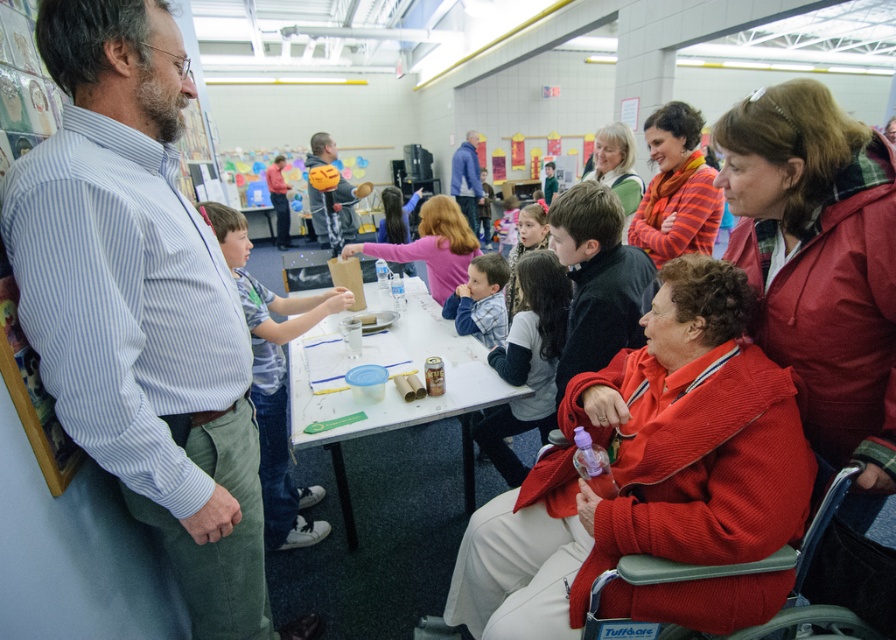
You are a photographer positioned at the back of the room. You want to capture a photo that includes both the blue striped shirt at left and the plaid fabric shirt at center. Which shirt should you adjust your camera angle to focus on first to ensure both are in the frame?

The blue striped shirt at left is located below the plaid fabric shirt at center, so you should focus on the plaid fabric shirt at center first to ensure both are visible in the frame.

You are standing in the room and see both the blue striped shirt at left and the plaid fabric shirt at center. Which shirt is positioned more to the left side of the room?

The blue striped shirt at left is positioned more to the left side of the room than the plaid fabric shirt at center.

You are attending a community event and notice two items in the scene. One is a red corduroy jacket at right and the other is an orange knitted scarf at upper center. Which item is positioned lower in the image?

The red corduroy jacket at right is positioned below the orange knitted scarf at upper center, so the red corduroy jacket at right is lower.